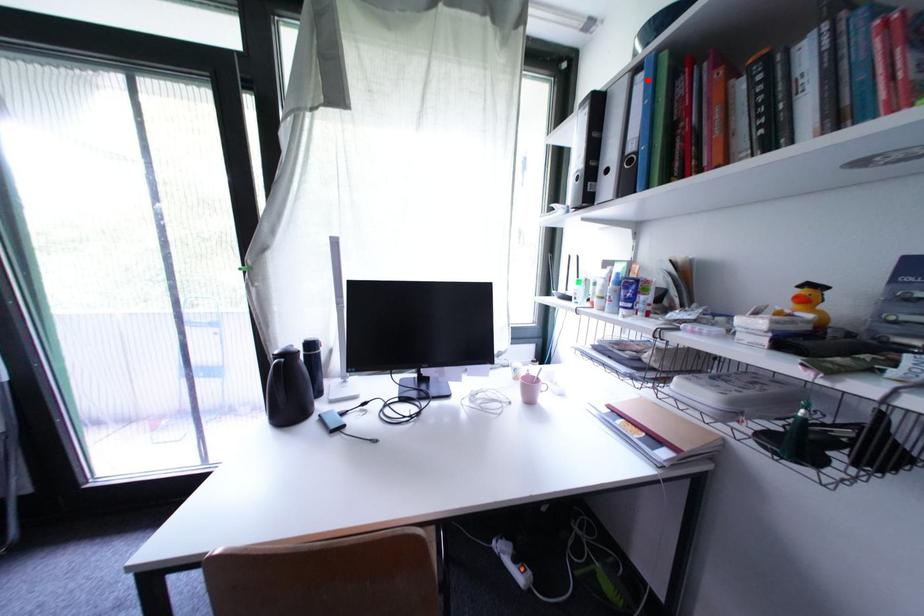
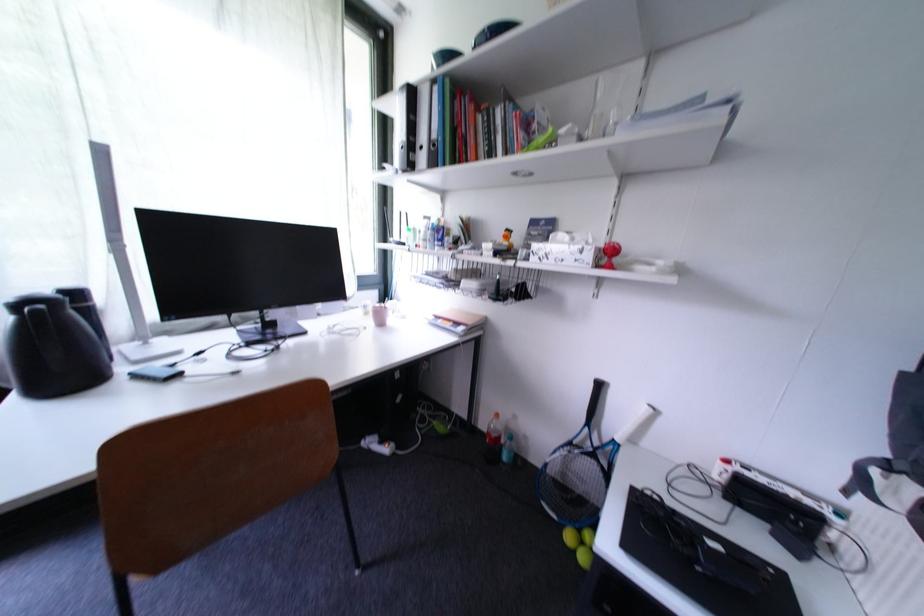
Locate, in the second image, the point that corresponds to the highlighted location in the first image.

(444, 91)